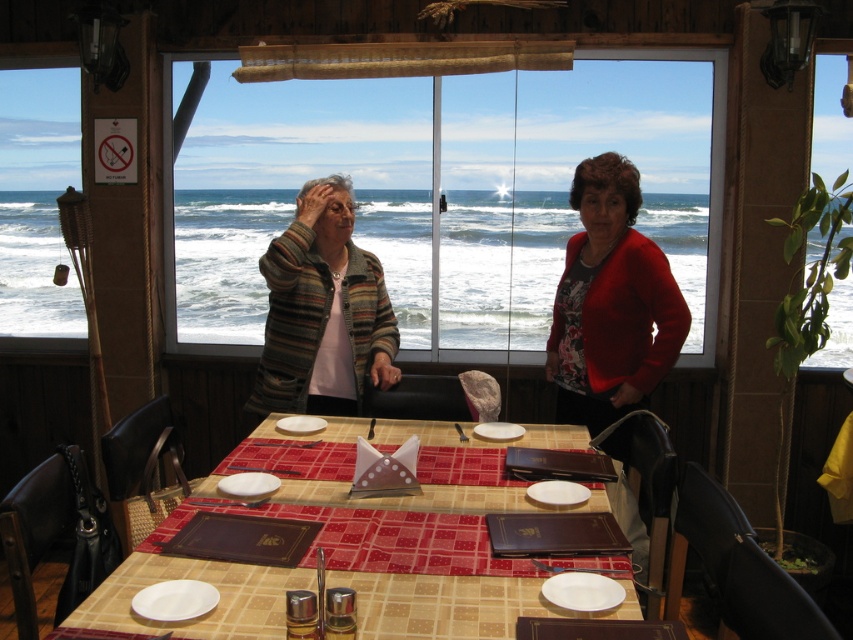
You are a guest at this dining table and want to place your coat on the seat next to the striped sweater at center. Where should you place your coat?

The striped sweater at center is located at coordinates point [611,301], so place your coat next to that position.